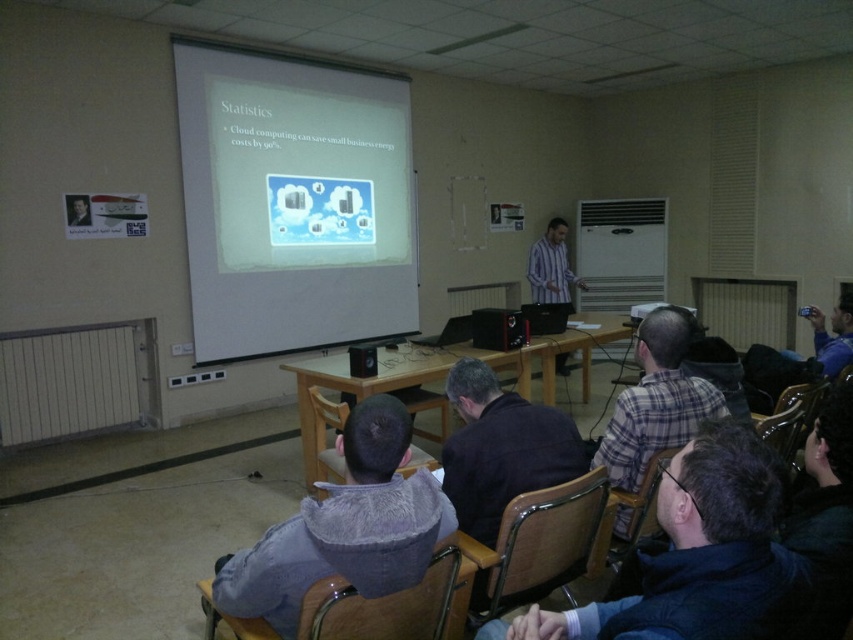
You are a student sitting in the classroom and want to hand in an assignment to the professor who is standing behind the wooden table with a laptop, a red speaker, and some papers. The professor is wearing a dark blue hoodie at lower right. Where should you go to find the professor?

The professor wearing the dark blue hoodie at lower right is located at point (698,556), so you should go to that location to hand in your assignment.

In the scene shown: You are a student sitting in the classroom and want to know which object is above the other between the white matte projection screen at upper center and the dark blue fabric at center. Can you determine this based on your observation?

The white matte projection screen at upper center is positioned over dark blue fabric at center, so the white matte projection screen at upper center is above the dark blue fabric at center.

You are a student sitting at the back of the classroom. You notice two points on the projector screen. The first point is at coordinates point [680,522] and the second point is at coordinates point [676,330]. Which point is closer to you?

Point [680,522] is in front of point [676,330], so the second point is closer to you.